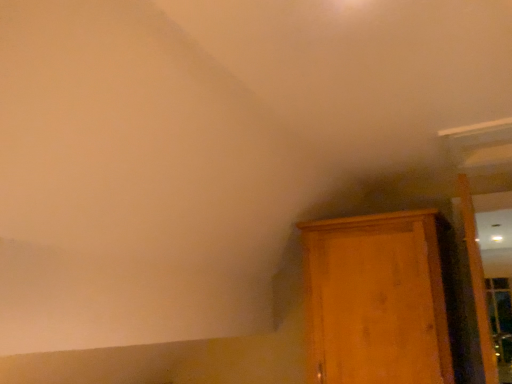
Question: Considering the positions of wooden cabinet at right and wooden door at right in the image, is wooden cabinet at right bigger or smaller than wooden door at right?

Choices:
 (A) small
 (B) big

Answer: (B)

Question: From the image's perspective, is wooden cabinet at right positioned above or below wooden door at right?

Choices:
 (A) below
 (B) above

Answer: (A)

Question: Based on their positions, is wooden cabinet at right located to the left or right of wooden door at right?

Choices:
 (A) left
 (B) right

Answer: (A)

Question: Is wooden door at right to the left or to the right of wooden cabinet at right in the image?

Choices:
 (A) right
 (B) left

Answer: (A)

Question: Is wooden door at right taller or shorter than wooden cabinet at right?

Choices:
 (A) short
 (B) tall

Answer: (B)

Question: Is wooden door at right in front of or behind wooden cabinet at right in the image?

Choices:
 (A) front
 (B) behind

Answer: (A)

Question: From a real-world perspective, relative to wooden cabinet at right, is wooden door at right vertically above or below?

Choices:
 (A) above
 (B) below

Answer: (A)